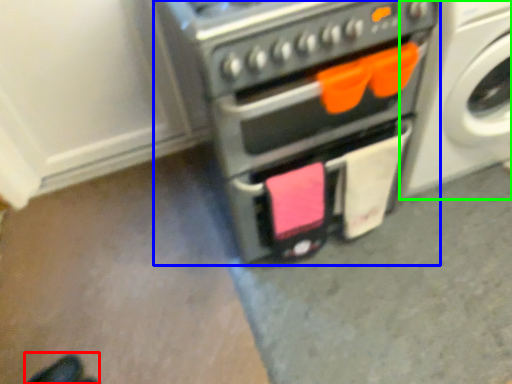
Question: Considering the real-world distances, which object is closest to footwear (highlighted by a red box)? home appliance (highlighted by a blue box) or washing machine (highlighted by a green box).

Choices:
 (A) home appliance
 (B) washing machine

Answer: (A)